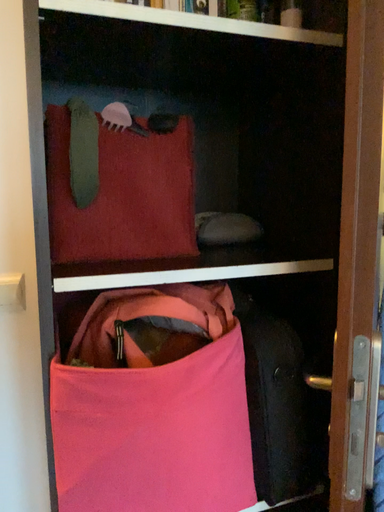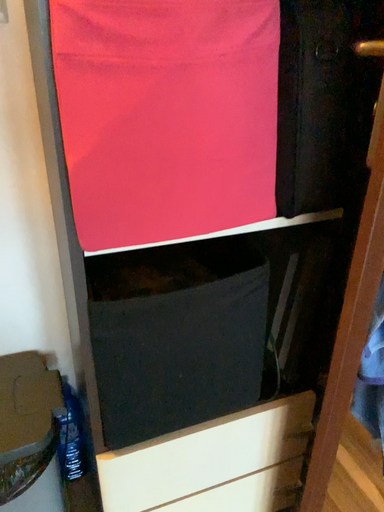
Question: How did the camera likely rotate when shooting the video?

Choices:
 (A) rotated upward
 (B) rotated downward

Answer: (B)